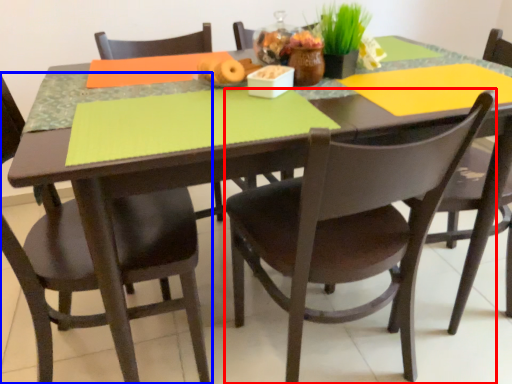
Question: Which object appears closest to the camera in this image, chair (highlighted by a red box) or chair (highlighted by a blue box)?

Choices:
 (A) chair
 (B) chair

Answer: (A)